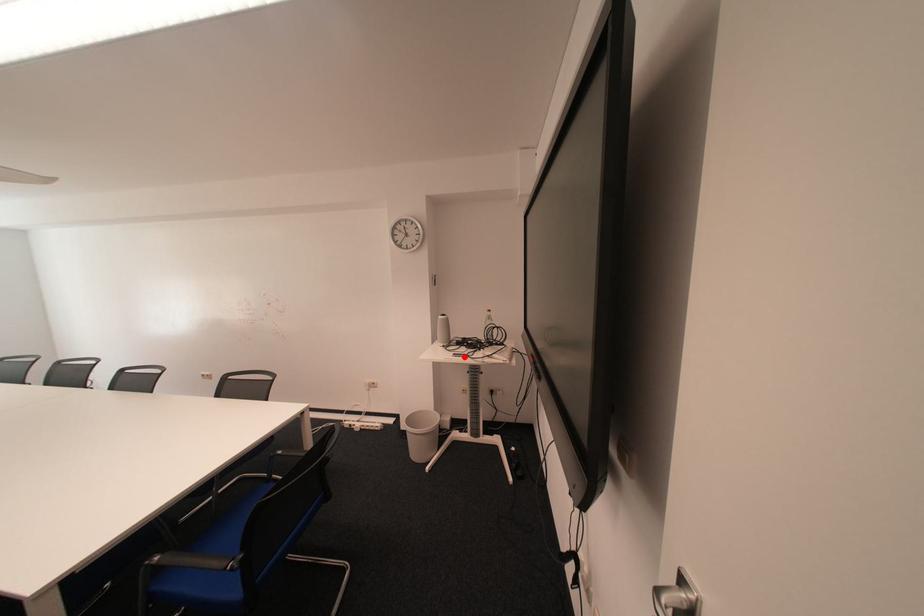
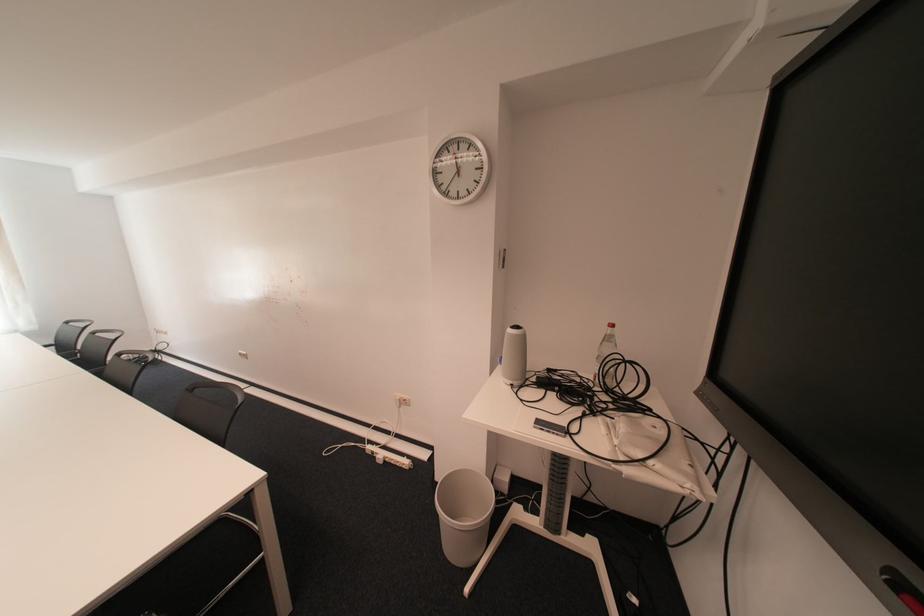
In the second image, find the point that corresponds to the highlighted location in the first image.

(545, 428)